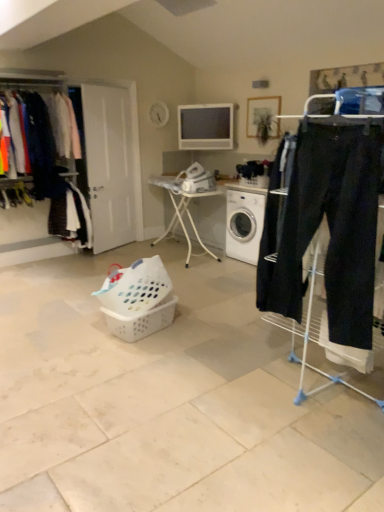
Question: From the image's perspective, is white plastic table at center beneath matte black pants at left, which appears as the first clothing when viewed from the top?

Choices:
 (A) no
 (B) yes

Answer: (B)

Question: From a real-world perspective, does white plastic table at center sit lower than matte black pants at left, the 2th clothing from the bottom?

Choices:
 (A) no
 (B) yes

Answer: (B)

Question: Does white plastic table at center have a smaller size compared to matte black pants at left, the 2th clothing from the bottom?

Choices:
 (A) yes
 (B) no

Answer: (B)

Question: Can you confirm if white plastic table at center is bigger than matte black pants at left, which appears as the first clothing when viewed from the top?

Choices:
 (A) yes
 (B) no

Answer: (A)

Question: Considering the relative sizes of white plastic table at center and matte black pants at left, which appears as the first clothing when viewed from the top, in the image provided, is white plastic table at center shorter than matte black pants at left, which appears as the first clothing when viewed from the top,?

Choices:
 (A) yes
 (B) no

Answer: (A)

Question: Is white plastic table at center positioned behind matte black pants at left, the 2th clothing from the bottom?

Choices:
 (A) no
 (B) yes

Answer: (B)

Question: Is matte black clothes at left looking in the opposite direction of white plastic basket at center, which is the 2th basket from top to bottom?

Choices:
 (A) yes
 (B) no

Answer: (B)

Question: From the image's perspective, is matte black clothes at left below white plastic basket at center, which is the 2th basket from top to bottom?

Choices:
 (A) yes
 (B) no

Answer: (B)

Question: Would you consider matte black clothes at left to be distant from white plastic basket at center, acting as the first basket starting from the bottom?

Choices:
 (A) yes
 (B) no

Answer: (A)

Question: Could you tell me if matte black clothes at left is turned towards white plastic basket at center, acting as the first basket starting from the bottom?

Choices:
 (A) yes
 (B) no

Answer: (A)

Question: Can you see matte black clothes at left touching white plastic basket at center, acting as the first basket starting from the bottom?

Choices:
 (A) no
 (B) yes

Answer: (A)

Question: Considering the relative sizes of matte black clothes at left and white plastic basket at center, acting as the first basket starting from the bottom, in the image provided, is matte black clothes at left thinner than white plastic basket at center, acting as the first basket starting from the bottom,?

Choices:
 (A) yes
 (B) no

Answer: (A)

Question: Would you say white plastic basket at center, which is the 2th basket from top to bottom, is part of matte black pants at left, the 2th clothing from the bottom,'s contents?

Choices:
 (A) no
 (B) yes

Answer: (A)